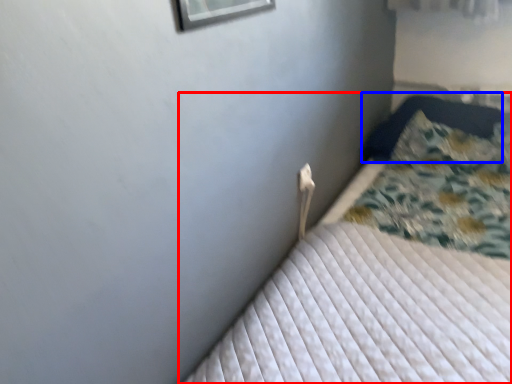
Question: Which object is further to the camera taking this photo, bed (highlighted by a red box) or pillow (highlighted by a blue box)?

Choices:
 (A) bed
 (B) pillow

Answer: (B)